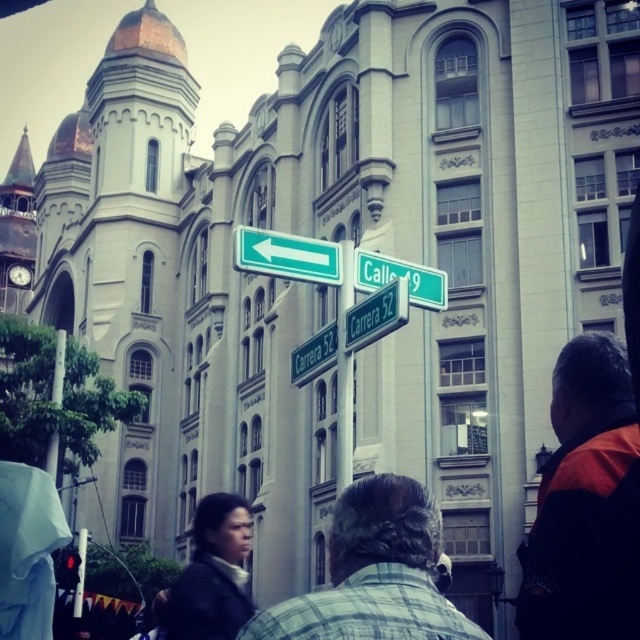
Is dark brown leather jacket at lower left positioned before green plastic signpost at center?

Yes, dark brown leather jacket at lower left is closer to the viewer.

Between dark brown leather jacket at lower left and green plastic signpost at center, which one has less height?

With less height is dark brown leather jacket at lower left.

Where is `dark brown leather jacket at lower left`? Image resolution: width=640 pixels, height=640 pixels. dark brown leather jacket at lower left is located at coordinates (212, 573).

Is point (342, 545) farther from viewer compared to point (355, 308)?

No, (342, 545) is closer to viewer.

Which is in front, point (342, 580) or point (380, 291)?

Positioned in front is point (342, 580).

Find the location of a particular element. gray plaid shirt at center is located at coordinates (372, 573).

Does green matte sign at upper center appear over green matte street sign at upper center?

Yes, green matte sign at upper center is above green matte street sign at upper center.

Who is shorter, green matte sign at upper center or green matte street sign at upper center?

green matte sign at upper center is shorter.

You are a GUI agent. You are given a task and a screenshot of the screen. Output one action in this format:
    pyautogui.click(x=<x>, y=<y>)
    Task: Click on the green matte sign at upper center
    This screenshot has height=640, width=640.
    Given the screenshot: What is the action you would take?
    pyautogui.click(x=285, y=256)

You are a GUI agent. You are given a task and a screenshot of the screen. Output one action in this format:
    pyautogui.click(x=<x>, y=<y>)
    Task: Click on the green matte sign at upper center
    
    Given the screenshot: What is the action you would take?
    pyautogui.click(x=285, y=256)